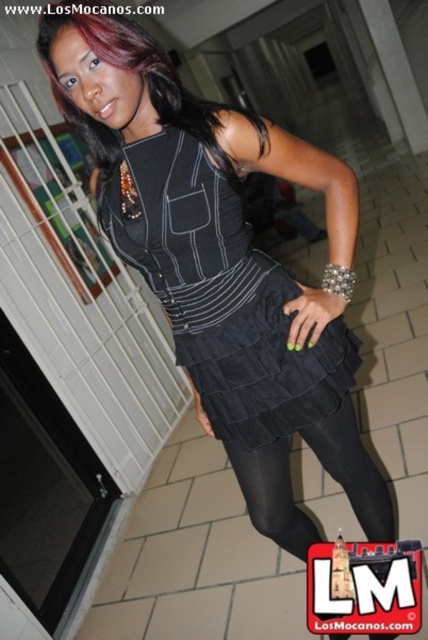
Based on the photo, you are a photographer setting up a shoot in this room. You need to ensure that the black suede dress at center is fully visible in the frame. Given that the black shiny hair at center is currently covering part of it, how can you adjust the subject or camera position to achieve this?

The black suede dress at center is positioned under the black shiny hair at center, so you can either ask the subject to move their hair to the side or adjust the camera angle to capture the dress without obstruction from the hair.

You are a fashion designer trying to create a new outfit that includes both the black suede dress at center and the black shiny hair at center. Since you need to ensure the dress and hair style complement each other in terms of visual balance, which one should you focus on adjusting in size to achieve harmony?

The black suede dress at center is wider than the black shiny hair at center, so to achieve harmony, you should consider adjusting the size of the black shiny hair at center to make it wider or the dress narrower to balance their widths.